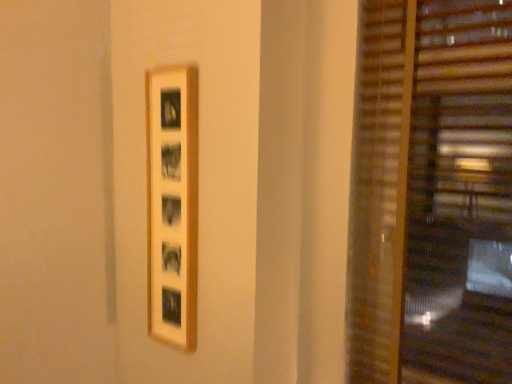
Question: Is point (145, 72) positioned closer to the camera than point (474, 256)?

Choices:
 (A) farther
 (B) closer

Answer: (A)

Question: From their relative heights in the image, would you say wooden picture frame at center is taller or shorter than wooden blinds at right?

Choices:
 (A) short
 (B) tall

Answer: (A)

Question: In terms of size, does wooden picture frame at center appear bigger or smaller than wooden blinds at right?

Choices:
 (A) big
 (B) small

Answer: (B)

Question: Choose the correct answer: Is wooden blinds at right inside wooden picture frame at center or outside it?

Choices:
 (A) inside
 (B) outside

Answer: (B)

Question: Is point (433, 165) closer or farther from the camera than point (193, 69)?

Choices:
 (A) farther
 (B) closer

Answer: (B)

Question: From the image's perspective, is wooden blinds at right located above or below wooden picture frame at center?

Choices:
 (A) above
 (B) below

Answer: (A)

Question: From a real-world perspective, is wooden blinds at right positioned above or below wooden picture frame at center?

Choices:
 (A) below
 (B) above

Answer: (B)